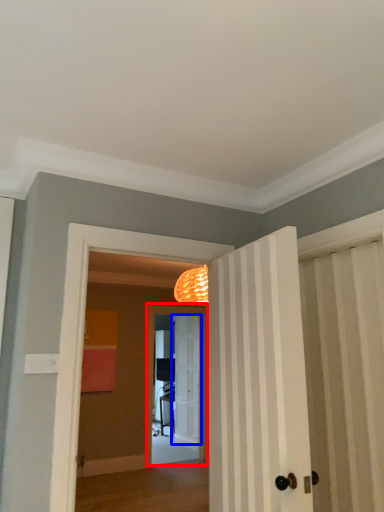
Question: Which object is further to the camera taking this photo, screen door (highlighted by a red box) or door (highlighted by a blue box)?

Choices:
 (A) screen door
 (B) door

Answer: (B)